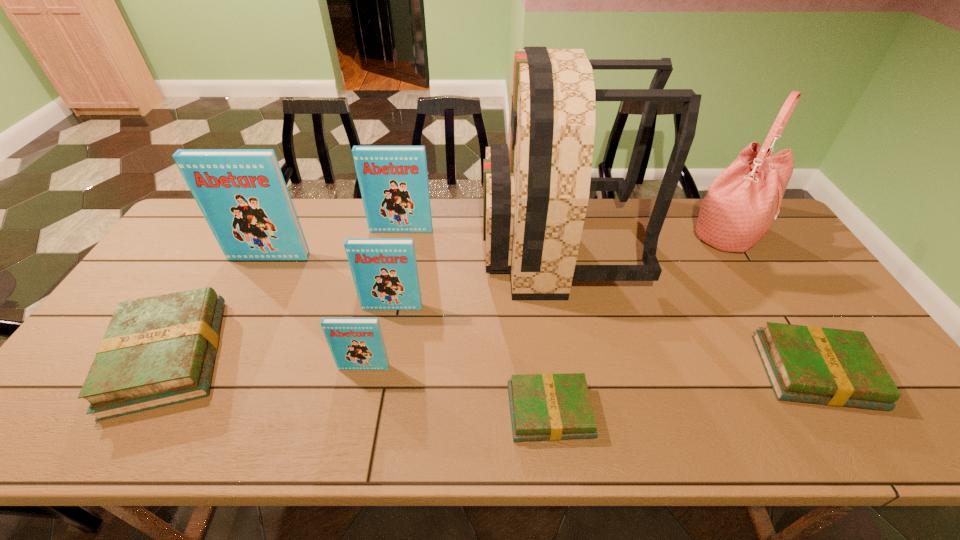
The width and height of the screenshot is (960, 540). I want to click on object at the left edge, so click(x=157, y=351).

You are a GUI agent. You are given a task and a screenshot of the screen. Output one action in this format:
    pyautogui.click(x=<x>, y=<y>)
    Task: Click on the handbag at the right edge
    
    Given the screenshot: What is the action you would take?
    pyautogui.click(x=742, y=202)

Find the location of `book present at the right edge`. book present at the right edge is located at coordinates (833, 367).

Find the location of a particular element. The width and height of the screenshot is (960, 540). object located in the near left corner section of the desktop is located at coordinates (157, 351).

Where is `object that is at the far right corner`? object that is at the far right corner is located at coordinates (742, 202).

I want to click on object located at the near right corner, so click(x=833, y=367).

Identify the location of free region at the far edge of the desktop. This screenshot has width=960, height=540. (309, 206).

Where is `vacant space at the near edge of the desktop`? This screenshot has height=540, width=960. vacant space at the near edge of the desktop is located at coordinates (478, 429).

Locate an element on the screen. The width and height of the screenshot is (960, 540). blank area at the right edge is located at coordinates (772, 283).

Identify the location of vacant region at the near left corner of the desktop. This screenshot has height=540, width=960. (95, 418).